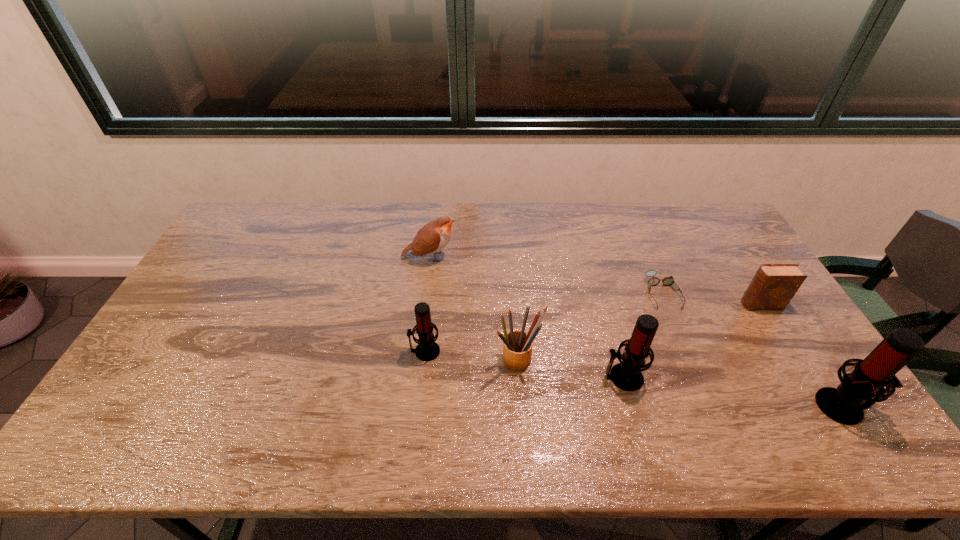
The width and height of the screenshot is (960, 540). Find the location of `diary`. diary is located at coordinates (774, 285).

Locate an element on the screen. Image resolution: width=960 pixels, height=540 pixels. free space located 0.230m on the left of the shortest microphone is located at coordinates pyautogui.click(x=326, y=351).

You are a GUI agent. You are given a task and a screenshot of the screen. Output one action in this format:
    pyautogui.click(x=<x>, y=<y>)
    Task: Click on the free point located 0.150m on the left of the second tallest microphone
    
    Given the screenshot: What is the action you would take?
    pyautogui.click(x=546, y=377)

At what (x,y) coordinates should I click in order to perform the action: click on vacant space located on the back of the rightmost microphone. Please return your answer as a coordinate pair (x, y). Looking at the image, I should click on (790, 325).

Image resolution: width=960 pixels, height=540 pixels. I want to click on vacant space located 0.220m on the front-facing side of the shortest object, so click(695, 372).

Where is `vacant point located 0.220m at the face of the bird`? The width and height of the screenshot is (960, 540). vacant point located 0.220m at the face of the bird is located at coordinates (523, 257).

Identify the location of vacant area situated 0.260m on the back of the third object from left to right. This screenshot has width=960, height=540. (512, 279).

Find the location of `free spot located 0.350m on the spine side of the diary`. free spot located 0.350m on the spine side of the diary is located at coordinates (626, 305).

Locate an element on the screen. The height and width of the screenshot is (540, 960). free space located on the spine side of the diary is located at coordinates (721, 305).

Where is `vacant space located on the spine side of the diary`? This screenshot has width=960, height=540. vacant space located on the spine side of the diary is located at coordinates (619, 305).